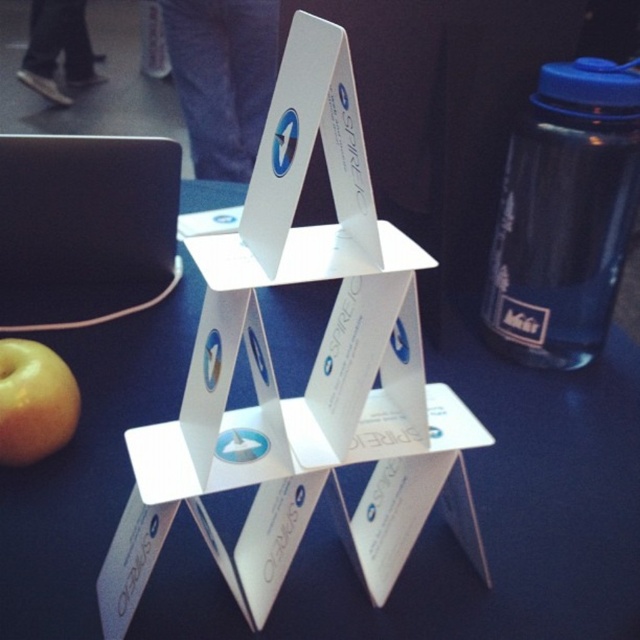
Question: Which point appears farthest from the camera in this image?

Choices:
 (A) (518, 371)
 (B) (65, 387)
 (C) (589, 266)

Answer: (A)

Question: Based on their relative distances, which object is farther from the white cardboard structure at center?

Choices:
 (A) yellow matte apple at lower left
 (B) blue plastic bottle at right

Answer: (A)

Question: Is blue plastic bottle at right thinner than yellow matte apple at lower left?

Choices:
 (A) no
 (B) yes

Answer: (A)

Question: Which point is closer to the camera taking this photo?

Choices:
 (A) (19, 346)
 (B) (552, 536)

Answer: (B)

Question: Considering the relative positions of blue plastic bottle at right and yellow matte apple at lower left in the image provided, where is blue plastic bottle at right located with respect to yellow matte apple at lower left?

Choices:
 (A) right
 (B) left

Answer: (A)

Question: Is white cardboard structure at center positioned before blue plastic bottle at right?

Choices:
 (A) no
 (B) yes

Answer: (B)